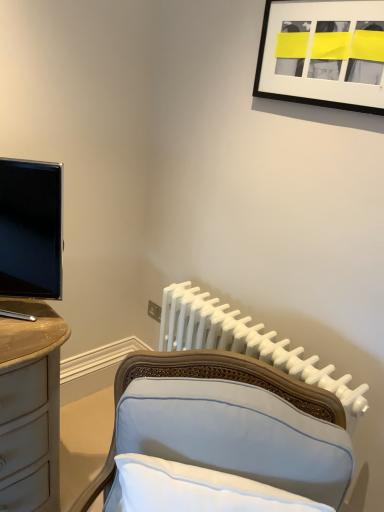
Question: Considering the positions of light blue fabric chair at lower center and white plastic radiator at center in the image, is light blue fabric chair at lower center wider or thinner than white plastic radiator at center?

Choices:
 (A) thin
 (B) wide

Answer: (B)

Question: From a real-world perspective, is light blue fabric chair at lower center physically located above or below white plastic radiator at center?

Choices:
 (A) below
 (B) above

Answer: (B)

Question: Considering the real-world distances, which object is closest to the white plastic radiator at center?

Choices:
 (A) light blue fabric chair at lower center
 (B) matte black tv at left
 (C) black matte picture frame at upper right

Answer: (A)

Question: Which object is the closest to the light blue fabric chair at lower center?

Choices:
 (A) white plastic radiator at center
 (B) matte black tv at left
 (C) black matte picture frame at upper right

Answer: (A)